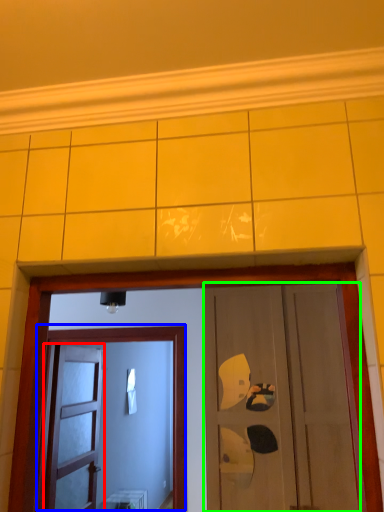
Question: Estimate the real-world distances between objects in this image. Which object is closer to door (highlighted by a red box), door (highlighted by a blue box) or door (highlighted by a green box)?

Choices:
 (A) door
 (B) door

Answer: (A)